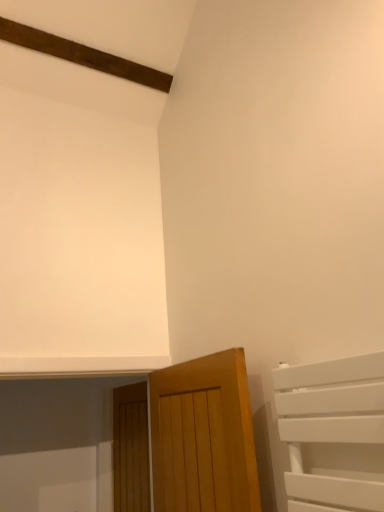
This screenshot has height=512, width=384. Describe the element at coordinates (131, 449) in the screenshot. I see `wooden door at center` at that location.

Measure the distance between wooden door at center and camera.

wooden door at center and camera are 8.12 feet apart.

Where is `wooden door at center`? The image size is (384, 512). wooden door at center is located at coordinates (131, 449).

Find the location of `wooden door at center`. wooden door at center is located at coordinates [131, 449].